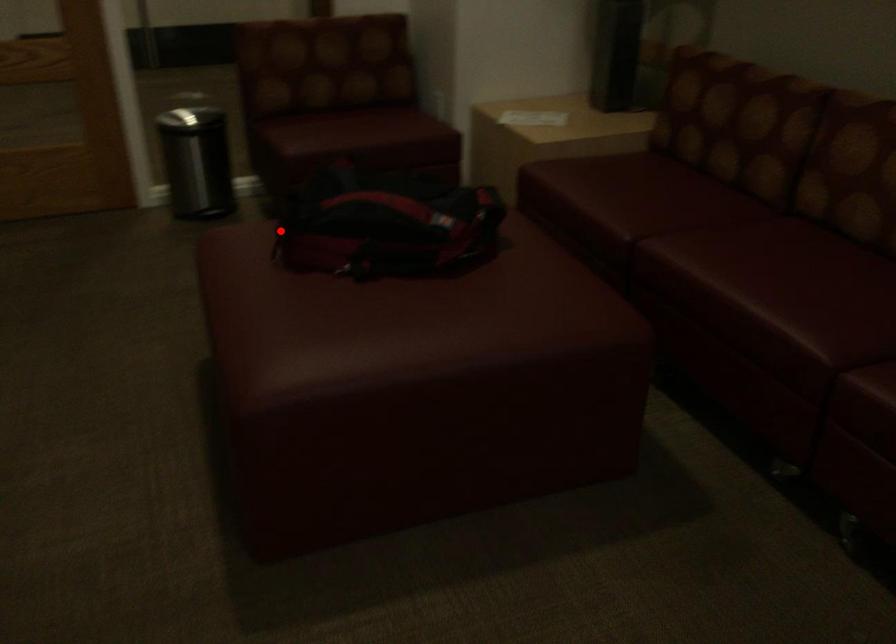
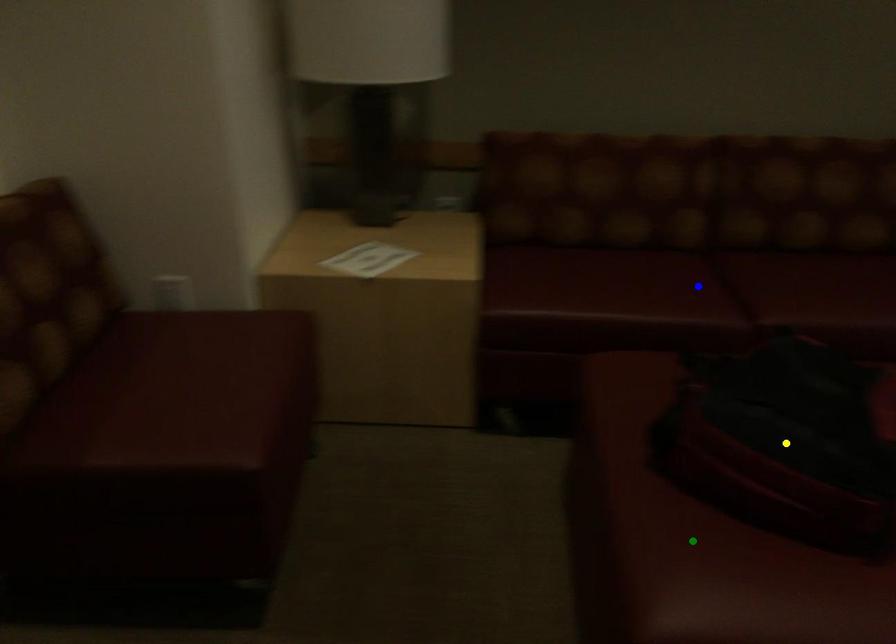
Question: I am providing you with two images of the same scene from different viewpoints. A red point is marked on the first image. You are given multiple points on the second image. Can you choose the point in image 2 that corresponds to the point in image 1?

Choices:
 (A) yellow point
 (B) green point
 (C) blue point

Answer: (B)